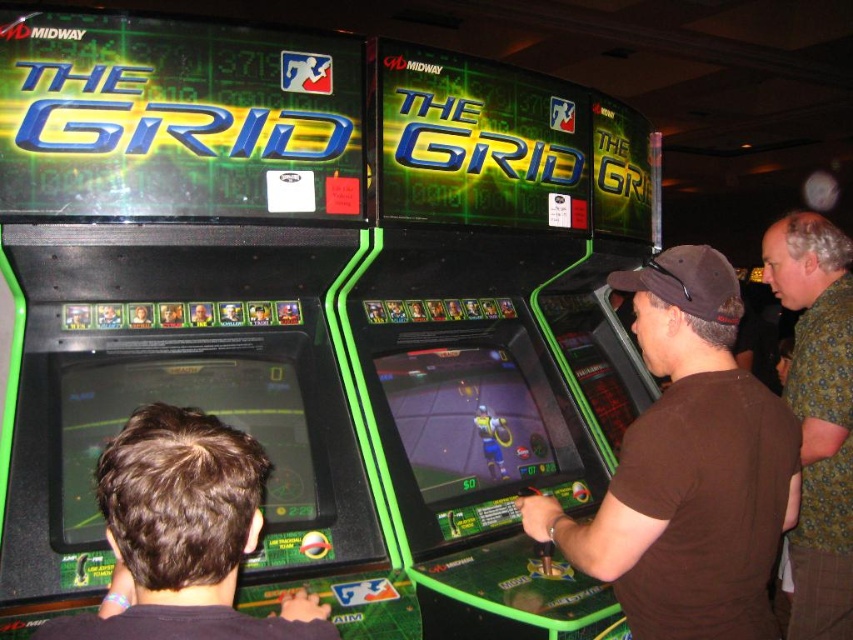
You are an arcade attendant and need to determine which of the two people, the brown matte hair at lower left or the green floral shirt at upper right, has a wider physical presence in the image. Based on the scene description, which one is wider?

The brown matte hair at lower left has a larger width than the green floral shirt at upper right, so the brown matte hair at lower left is wider.

You are a person with a height of 1.6 meters. You want to reach the point at point (645, 349). How many steps do you need to take if each step is 0.7 meters?

The distance to the point is 1.46 meters. Since each step is 0.7 meters, you would need 2 steps to reach the point.